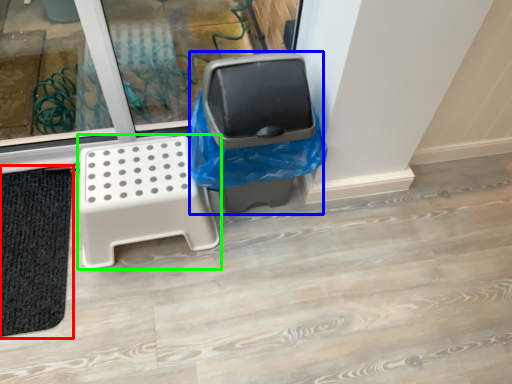
Question: Which is farther away from bath mat (highlighted by a red box)? garbage (highlighted by a blue box) or furniture (highlighted by a green box)?

Choices:
 (A) garbage
 (B) furniture

Answer: (A)